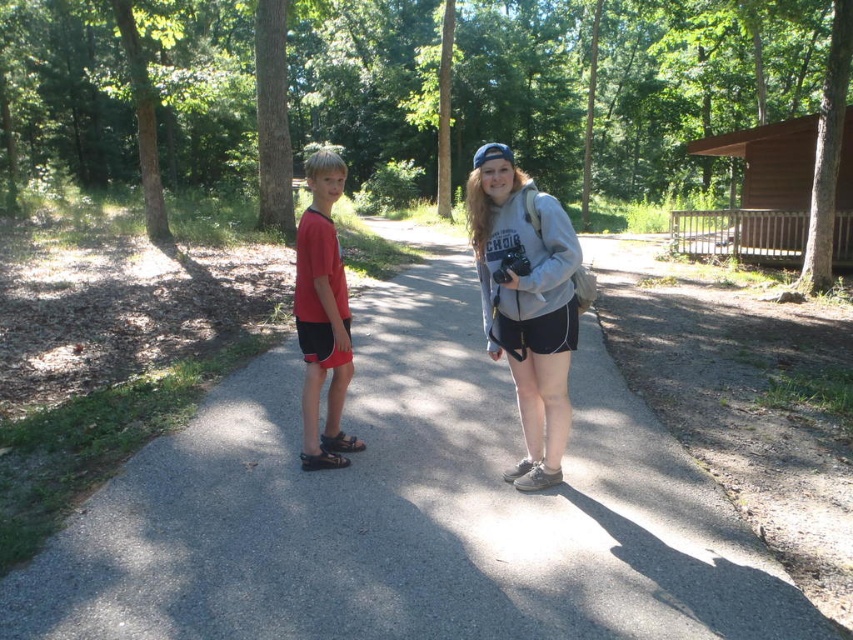
You are standing at the entrance of the path and want to take a photo of the gray asphalt trail at center. Where should you position yourself to capture the entire trail in your camera frame?

The gray asphalt trail at center is located at point [409,509], so you should position yourself at the entrance facing towards that coordinate to capture the entire trail.

You are standing on the paved path in the wooded area and want to walk towards the direction of the person on the right. Which point, point (236, 506) or point (326, 266), is closer to your destination?

Point (236, 506) is in front of point (326, 266), so it is closer to your destination.